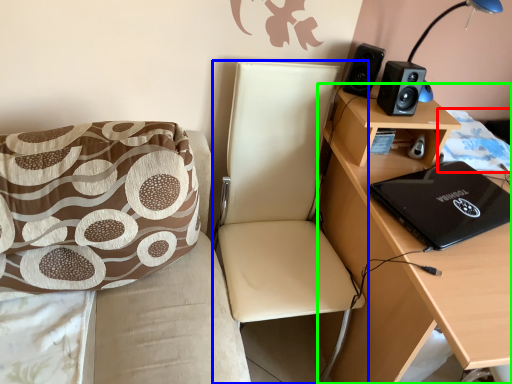
Question: Which object is positioned farthest from quilt (highlighted by a red box)? Select from chair (highlighted by a blue box) and desk (highlighted by a green box).

Choices:
 (A) chair
 (B) desk

Answer: (A)